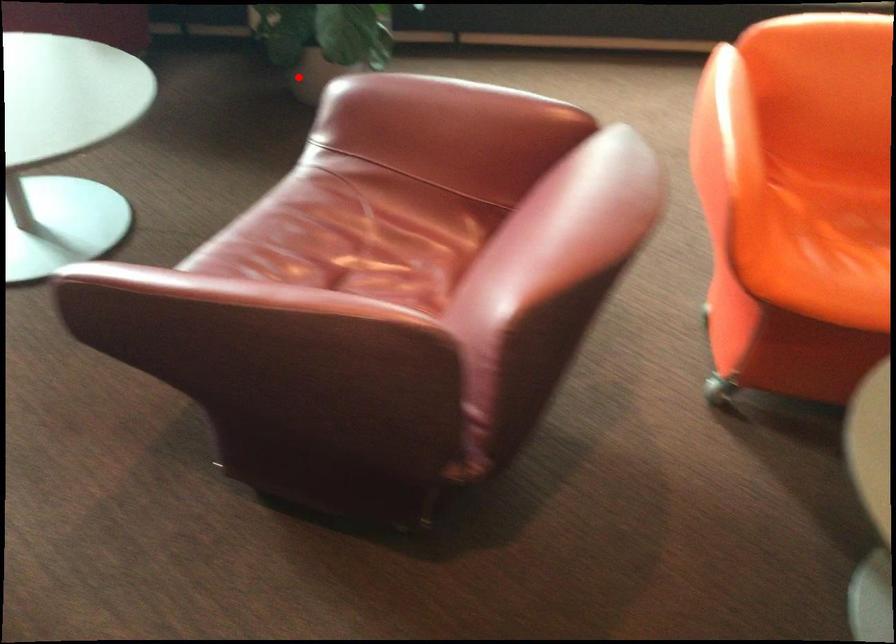
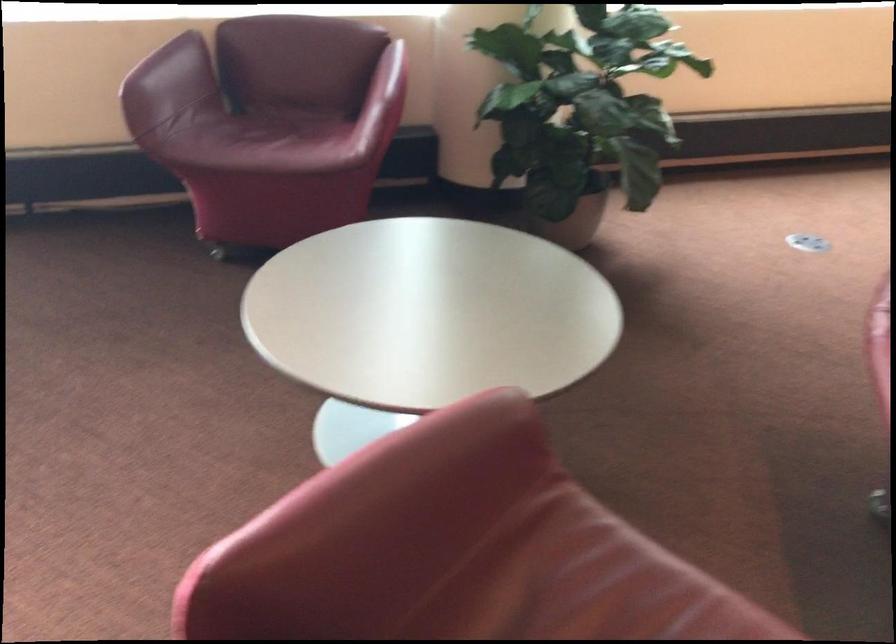
In the second image, find the point that corresponds to the highlighted location in the first image.

(573, 223)